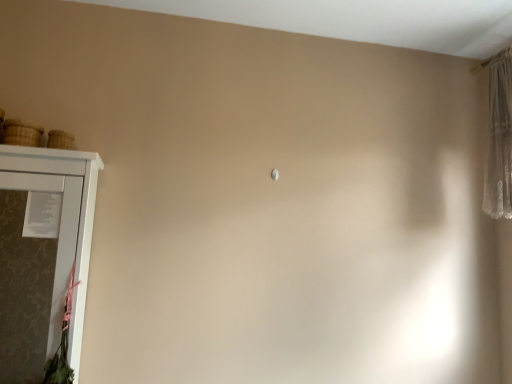
Where is `woven straw basket at upper left, placed as the second basket when sorted from left to right`? The image size is (512, 384). woven straw basket at upper left, placed as the second basket when sorted from left to right is located at coordinates (60, 140).

Is woven straw basket at upper left, placed as the second basket when sorted from left to right, to the left of white matte cupboard at left from the viewer's perspective?

No, woven straw basket at upper left, placed as the second basket when sorted from left to right, is not to the left of white matte cupboard at left.

Looking at their sizes, would you say woven straw basket at upper left, which appears as the 1th basket when viewed from the right, is wider or thinner than white matte cupboard at left?

woven straw basket at upper left, which appears as the 1th basket when viewed from the right, is thinner than white matte cupboard at left.

How different are the orientations of woven straw basket at upper left, placed as the second basket when sorted from left to right, and white matte cupboard at left in degrees?

The facing directions of woven straw basket at upper left, placed as the second basket when sorted from left to right, and white matte cupboard at left are 1.13 degrees apart.

Considering the relative sizes of white matte cupboard at left and brown woven basket at left, the second basket from the right, in the image provided, is white matte cupboard at left smaller than brown woven basket at left, the second basket from the right,?

Actually, white matte cupboard at left might be larger than brown woven basket at left, the second basket from the right.

Does white matte cupboard at left appear on the right side of brown woven basket at left, the second basket from the right?

Correct, you'll find white matte cupboard at left to the right of brown woven basket at left, the second basket from the right.

From a real-world perspective, is white matte cupboard at left located higher than brown woven basket at left, the second basket from the right?

No, from a real-world perspective, white matte cupboard at left is not over brown woven basket at left, the second basket from the right

Is brown woven basket at left, arranged as the 1th basket when viewed from the left, located within white matte cupboard at left?

Actually, brown woven basket at left, arranged as the 1th basket when viewed from the left, is outside white matte cupboard at left.

Is brown woven basket at left, the second basket from the right, bigger than woven straw basket at upper left, placed as the second basket when sorted from left to right?

Indeed, brown woven basket at left, the second basket from the right, has a larger size compared to woven straw basket at upper left, placed as the second basket when sorted from left to right.

The image size is (512, 384). Find the location of `basket on the left of woven straw basket at upper left, placed as the second basket when sorted from left to right`. basket on the left of woven straw basket at upper left, placed as the second basket when sorted from left to right is located at coordinates (21, 133).

Could you measure the distance between brown woven basket at left, arranged as the 1th basket when viewed from the left, and woven straw basket at upper left, placed as the second basket when sorted from left to right?

7.41 centimeters.

Which object is wider, brown woven basket at left, the second basket from the right, or woven straw basket at upper left, placed as the second basket when sorted from left to right?

With larger width is brown woven basket at left, the second basket from the right.

In the scene shown: Could you tell me if woven straw basket at upper left, which appears as the 1th basket when viewed from the right, is turned towards brown woven basket at left, the second basket from the right?

No.

How many degrees apart are the facing directions of woven straw basket at upper left, which appears as the 1th basket when viewed from the right, and brown woven basket at left, the second basket from the right?

0.00503 degrees separate the facing orientations of woven straw basket at upper left, which appears as the 1th basket when viewed from the right, and brown woven basket at left, the second basket from the right.

Between woven straw basket at upper left, which appears as the 1th basket when viewed from the right, and brown woven basket at left, arranged as the 1th basket when viewed from the left, which one has smaller width?

woven straw basket at upper left, which appears as the 1th basket when viewed from the right, is thinner.

From the image's perspective, does woven straw basket at upper left, placed as the second basket when sorted from left to right, appear higher than brown woven basket at left, arranged as the 1th basket when viewed from the left?

Actually, woven straw basket at upper left, placed as the second basket when sorted from left to right, appears below brown woven basket at left, arranged as the 1th basket when viewed from the left, in the image.

Is brown woven basket at left, the second basket from the right, far from white matte cupboard at left?

Yes, brown woven basket at left, the second basket from the right, is far from white matte cupboard at left.

Which is behind, point (33, 131) or point (36, 169)?

Point (33, 131)

Based on the photo, is brown woven basket at left, arranged as the 1th basket when viewed from the left, oriented away from white matte cupboard at left?

No, brown woven basket at left, arranged as the 1th basket when viewed from the left, is not facing away from white matte cupboard at left.

In the image, there is a brown woven basket at left, the second basket from the right. Find the location of `cupboard below it (from a real-world perspective)`. cupboard below it (from a real-world perspective) is located at coordinates (42, 255).

Relative to woven straw basket at upper left, placed as the second basket when sorted from left to right, is white matte cupboard at left in front or behind?

white matte cupboard at left is in front of woven straw basket at upper left, placed as the second basket when sorted from left to right.

Is white matte cupboard at left inside the boundaries of woven straw basket at upper left, which appears as the 1th basket when viewed from the right, or outside?

white matte cupboard at left is not inside woven straw basket at upper left, which appears as the 1th basket when viewed from the right, it's outside.

Is white matte cupboard at left next to woven straw basket at upper left, placed as the second basket when sorted from left to right?

No, white matte cupboard at left is not making contact with woven straw basket at upper left, placed as the second basket when sorted from left to right.

Which is farther from the camera, (60, 153) or (50, 144)?

Positioned behind is point (50, 144).

You are a GUI agent. You are given a task and a screenshot of the screen. Output one action in this format:
    pyautogui.click(x=<x>, y=<y>)
    Task: Click on the cupboard located in front of the woven straw basket at upper left, placed as the second basket when sorted from left to right
    This screenshot has height=384, width=512.
    Given the screenshot: What is the action you would take?
    pyautogui.click(x=42, y=255)

Identify the location of basket that is the 2nd one above the white matte cupboard at left (from a real-world perspective). This screenshot has width=512, height=384. (21, 133).

Looking at the image, which one is located further to woven straw basket at upper left, placed as the second basket when sorted from left to right, white matte cupboard at left or brown woven basket at left, the second basket from the right?

white matte cupboard at left is positioned further to the anchor woven straw basket at upper left, placed as the second basket when sorted from left to right.

Considering their positions, is brown woven basket at left, the second basket from the right, positioned closer to woven straw basket at upper left, which appears as the 1th basket when viewed from the right, than white matte cupboard at left?

Based on the image, brown woven basket at left, the second basket from the right, appears to be nearer to woven straw basket at upper left, which appears as the 1th basket when viewed from the right.

Based on their spatial positions, is woven straw basket at upper left, which appears as the 1th basket when viewed from the right, or brown woven basket at left, arranged as the 1th basket when viewed from the left, closer to white matte cupboard at left?

brown woven basket at left, arranged as the 1th basket when viewed from the left, is positioned closer to the anchor white matte cupboard at left.

From the image, which object appears to be nearer to brown woven basket at left, arranged as the 1th basket when viewed from the left, white matte cupboard at left or woven straw basket at upper left, which appears as the 1th basket when viewed from the right?

woven straw basket at upper left, which appears as the 1th basket when viewed from the right, is closer to brown woven basket at left, arranged as the 1th basket when viewed from the left.

Which object lies nearer to the anchor point white matte cupboard at left, brown woven basket at left, arranged as the 1th basket when viewed from the left, or woven straw basket at upper left, which appears as the 1th basket when viewed from the right?

brown woven basket at left, arranged as the 1th basket when viewed from the left, is positioned closer to the anchor white matte cupboard at left.

When comparing their distances from brown woven basket at left, the second basket from the right, does woven straw basket at upper left, placed as the second basket when sorted from left to right, or white matte cupboard at left seem closer?

Based on the image, woven straw basket at upper left, placed as the second basket when sorted from left to right, appears to be nearer to brown woven basket at left, the second basket from the right.

Where is `basket between brown woven basket at left, the second basket from the right, and white matte cupboard at left from top to bottom`? basket between brown woven basket at left, the second basket from the right, and white matte cupboard at left from top to bottom is located at coordinates (60, 140).